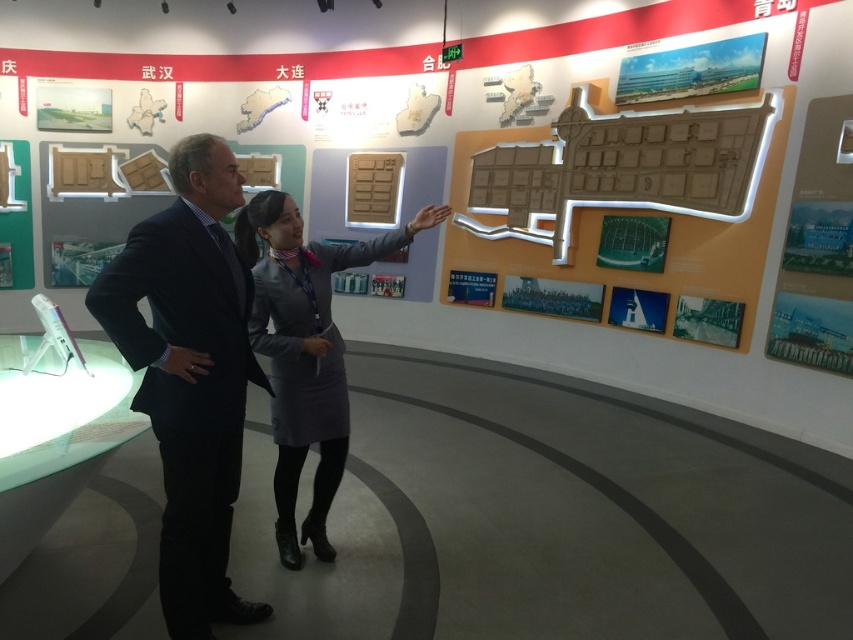
You are a security guard in the museum and need to locate the person wearing the dark blue suit at center. According to the coordinates provided, where should you look in the image?

The dark blue suit at center is located at point (190, 374), so you should look at that coordinate position in the image to find the person wearing it.

You are standing in the museum and see two points marked in the image. Which point is closer to you, point (227,173) or point (332,333)?

Point (227,173) is closer to the viewer than point (332,333).

You are an event planner observing the scene. You need to arrange a photo shoot where the dark blue suit at center and gray fabric dress at center must be visible. Which clothing item should be positioned higher to ensure both are visible in the photo?

The dark blue suit at center should be positioned higher since it is already above the gray fabric dress at center, ensuring both are visible in the photo.